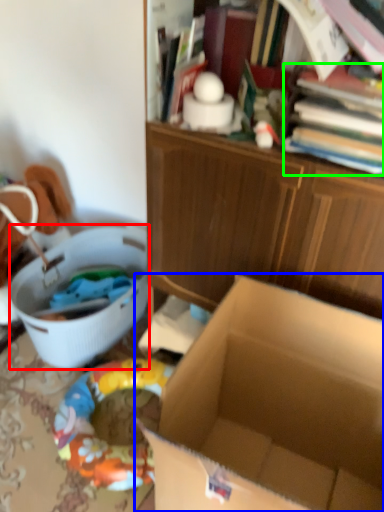
Question: Which object is the closest to the laundry basket (highlighted by a red box)? Choose among these: box (highlighted by a blue box) or book (highlighted by a green box).

Choices:
 (A) box
 (B) book

Answer: (A)